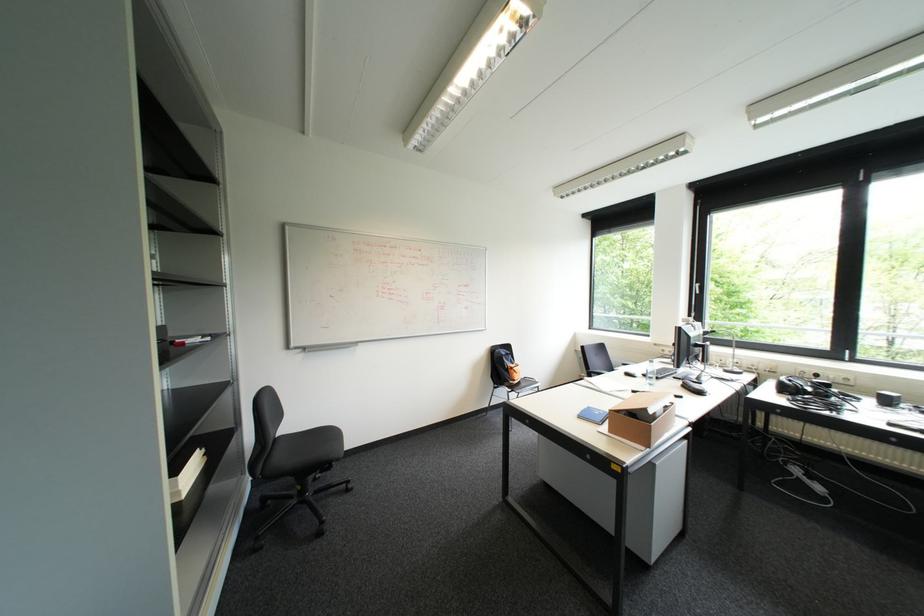
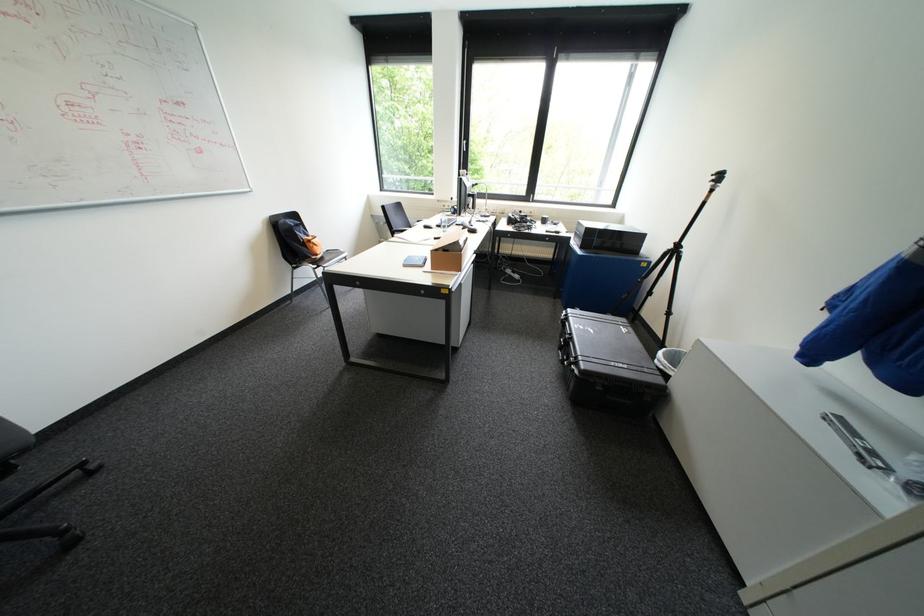
Find the pixel in the second image that matches point (592, 408) in the first image.

(415, 257)